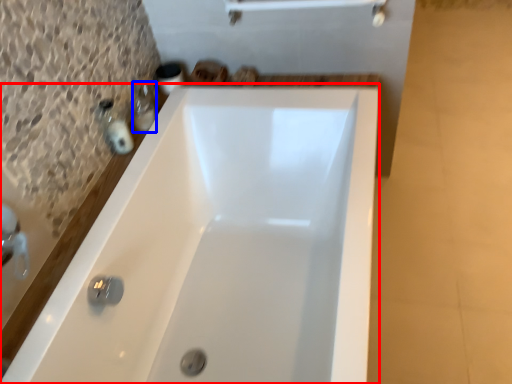
Question: Which object is further to the camera taking this photo, bathtub (highlighted by a red box) or toiletry (highlighted by a blue box)?

Choices:
 (A) bathtub
 (B) toiletry

Answer: (B)